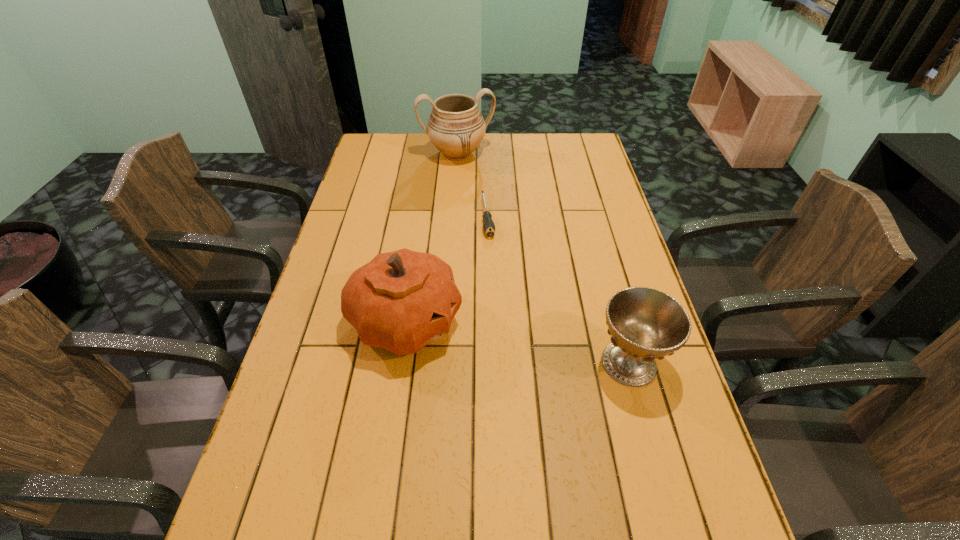
Locate an element on the screen. This screenshot has width=960, height=540. free space at the far left corner of the desktop is located at coordinates (372, 136).

Locate an element on the screen. The width and height of the screenshot is (960, 540). blank space at the far right corner of the desktop is located at coordinates (564, 137).

Where is `free space at the near right corner of the desktop`? free space at the near right corner of the desktop is located at coordinates (687, 476).

Image resolution: width=960 pixels, height=540 pixels. Find the location of `unoccupied position between the chalice and the shortest object`. unoccupied position between the chalice and the shortest object is located at coordinates (559, 289).

Locate an element on the screen. Image resolution: width=960 pixels, height=540 pixels. free space that is in between the chalice and the shortest object is located at coordinates (559, 289).

This screenshot has width=960, height=540. I want to click on free area in between the chalice and the third nearest object, so click(x=559, y=289).

Find the location of a particular element. The height and width of the screenshot is (540, 960). unoccupied area between the chalice and the screwdriver is located at coordinates (559, 289).

Find the location of `vacant space in between the shortest object and the rightmost object`. vacant space in between the shortest object and the rightmost object is located at coordinates (559, 289).

Locate an element on the screen. This screenshot has width=960, height=540. free space between the pumpkin and the chalice is located at coordinates (517, 342).

Locate an element on the screen. The height and width of the screenshot is (540, 960). free space that is in between the pumpkin and the urn is located at coordinates (432, 238).